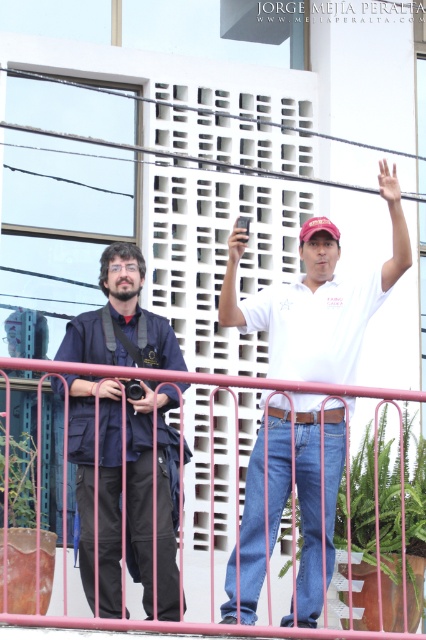
You are a fashion designer observing two people on a balcony. You notice the white cotton shirt at center and the dark blue fabric jacket at left. Which clothing item is located lower in the image?

The white cotton shirt at center is positioned under the dark blue fabric jacket at left, so it is lower in the image.

You are a tailor measuring for a new jacket. You observe the dark blue fabric jacket at left and the pink metal fence at lower center in the image. Which object is narrower in width?

The dark blue fabric jacket at left is narrower in width than the pink metal fence at lower center.